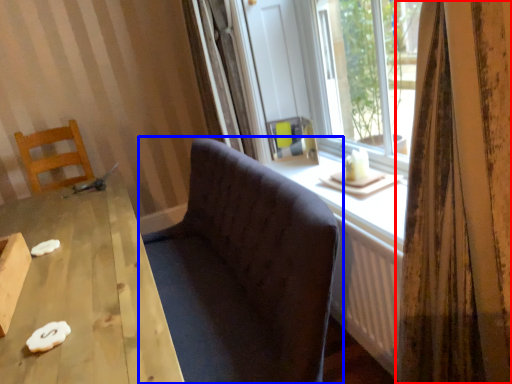
Question: Which of the following is the farthest to the observer, curtain (highlighted by a red box) or studio couch (highlighted by a blue box)?

Choices:
 (A) curtain
 (B) studio couch

Answer: (B)